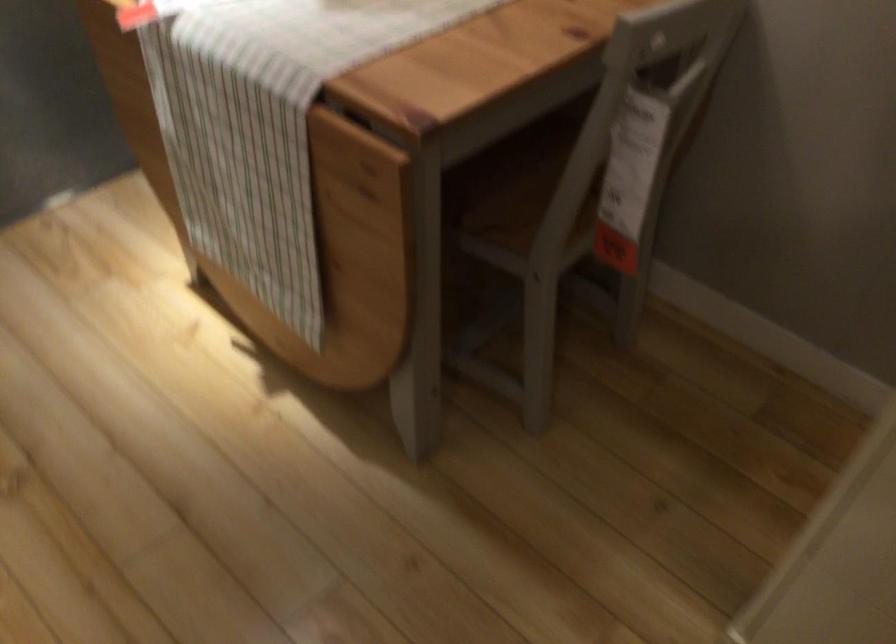
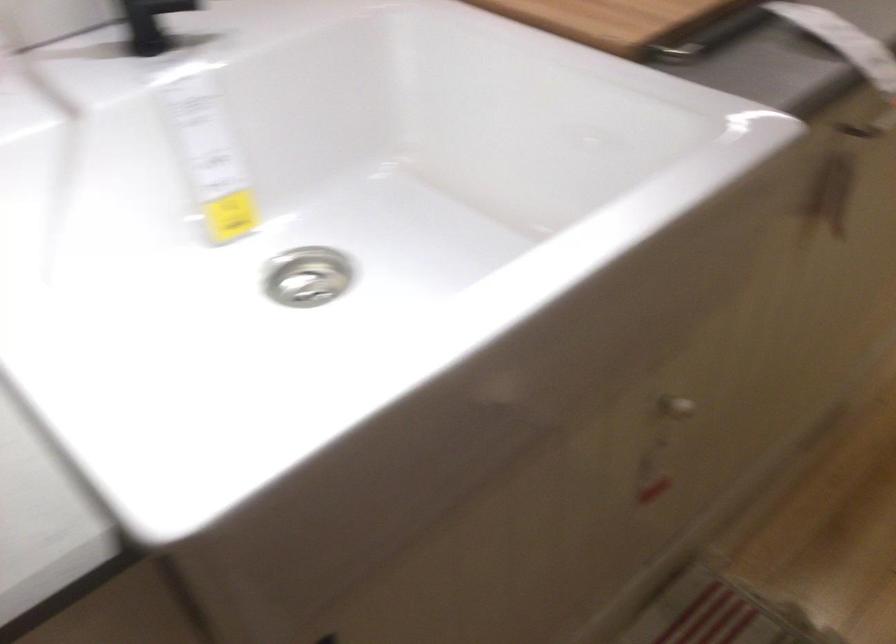
The images are taken continuously from a first-person perspective. In which direction is your viewpoint rotating?

The camera rotated toward left-down.